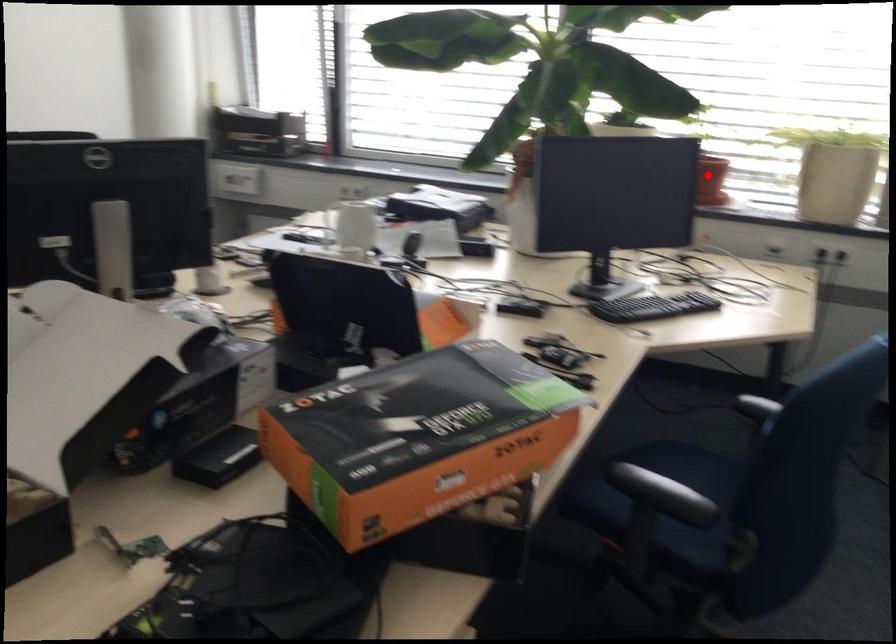
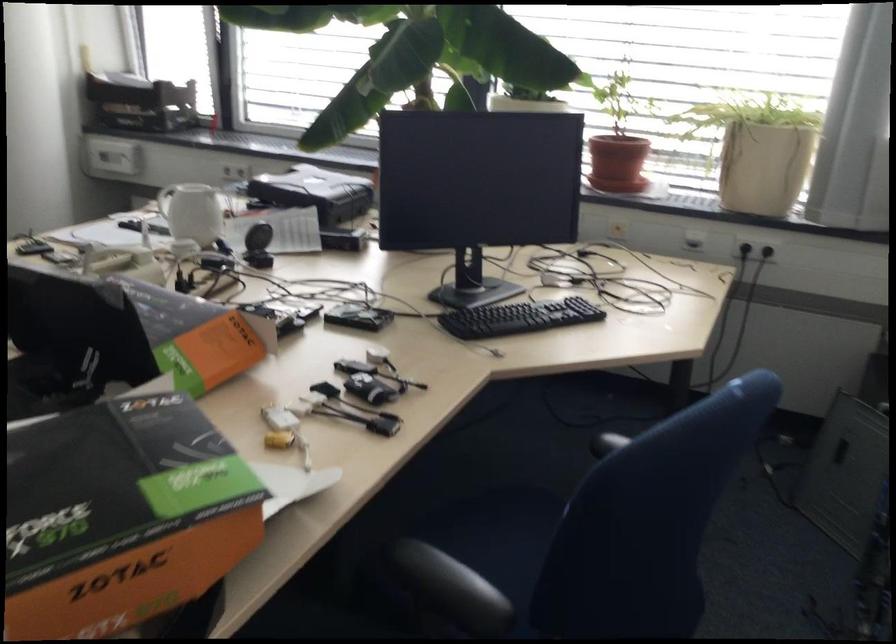
Question: I am providing you with two images of the same scene from different viewpoints. A red point is shown in image1. For the corresponding object point in image2, is it positioned nearer or farther from the camera?

Choices:
 (A) Nearer
 (B) Farther

Answer: (A)